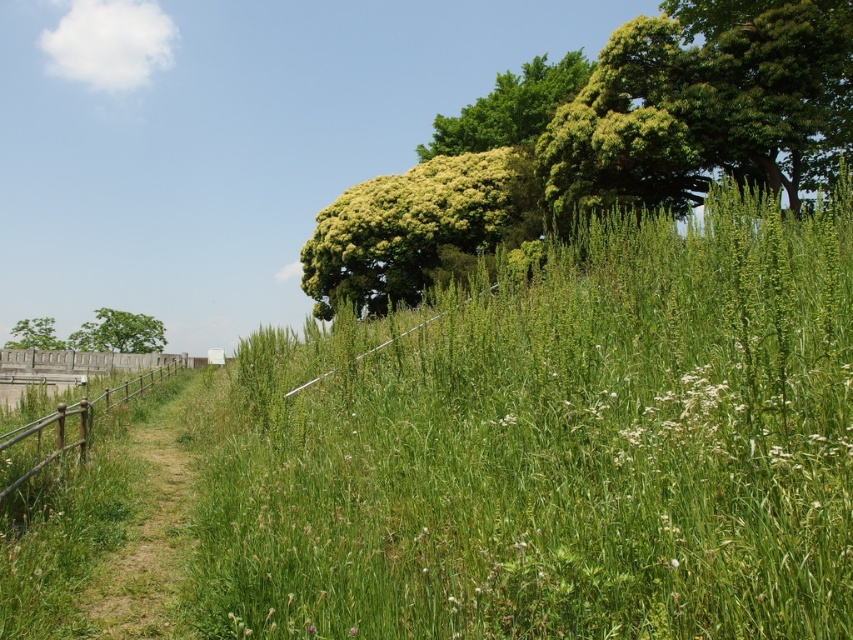
Question: Which point is closer to the camera?

Choices:
 (A) (659, 422)
 (B) (45, 348)

Answer: (A)

Question: Which of the following is the closest to the observer?

Choices:
 (A) green grassy trail at lower left
 (B) green leafy tree at upper right
 (C) green grassy at upper center

Answer: (C)

Question: Does green leafy tree at center have a larger size compared to green leafy tree at upper center?

Choices:
 (A) yes
 (B) no

Answer: (B)

Question: Can you confirm if green leafy tree at upper right is positioned below green grassy trail at lower left?

Choices:
 (A) no
 (B) yes

Answer: (A)

Question: Which is nearer to the brown wooden fence at left?

Choices:
 (A) green grassy at upper center
 (B) green leafy tree at lower left
 (C) green grassy trail at lower left

Answer: (C)

Question: Is green grassy trail at lower left above brown wooden fence at left?

Choices:
 (A) no
 (B) yes

Answer: (A)